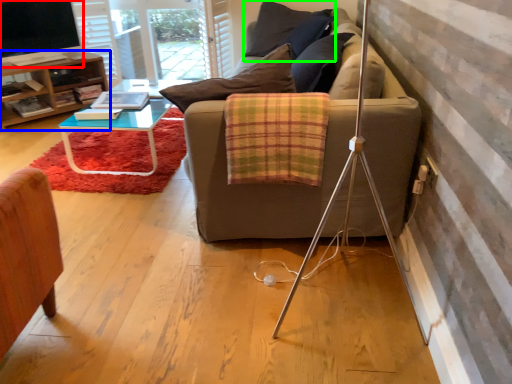
Question: Based on their relative distances, which object is farther from television (highlighted by a red box)? Choose from table (highlighted by a blue box) and pillow (highlighted by a green box).

Choices:
 (A) table
 (B) pillow

Answer: (B)